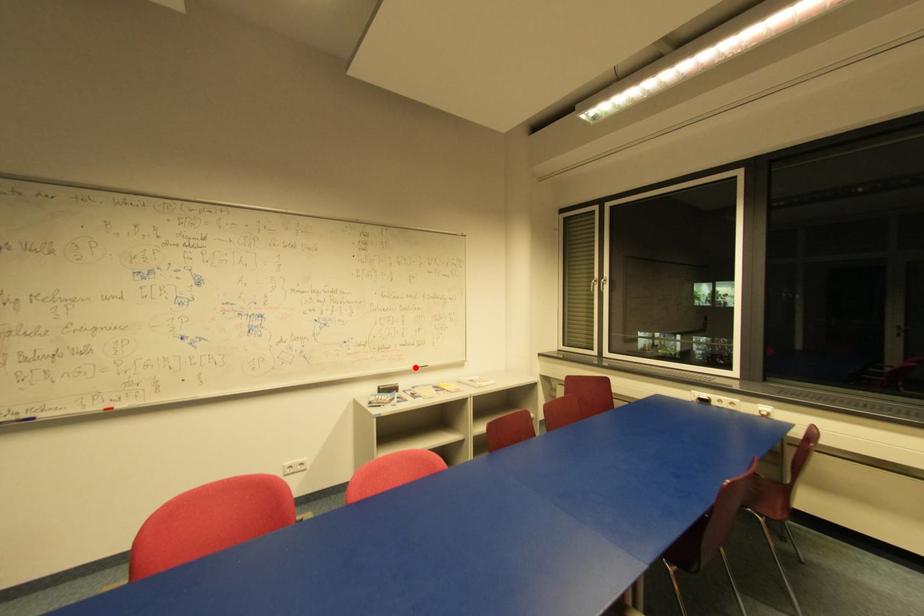
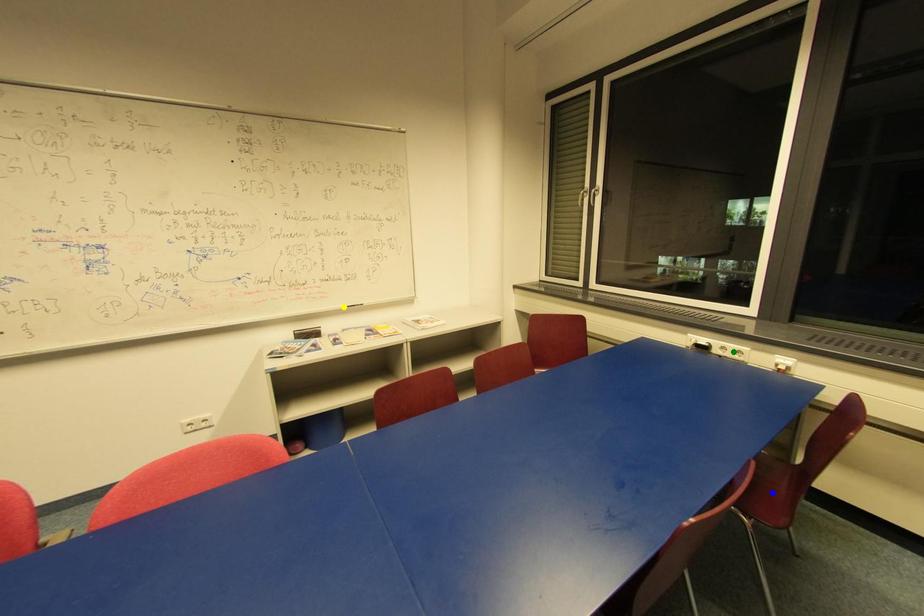
Question: I am providing you with two images of the same scene from different viewpoints. A red point is marked on the first image. You are given multiple points on the second image. Which point in image 2 is actually the same real-world point as the red point in image 1?

Choices:
 (A) green point
 (B) blue point
 (C) yellow point

Answer: (C)